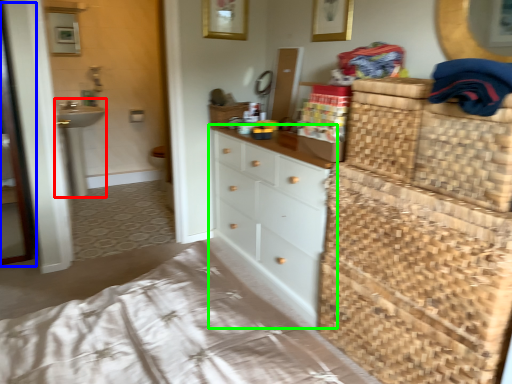
Question: Which object is positioned farthest from sink (highlighted by a red box)? Select from screen door (highlighted by a blue box) and chest of drawers (highlighted by a green box).

Choices:
 (A) screen door
 (B) chest of drawers

Answer: (B)